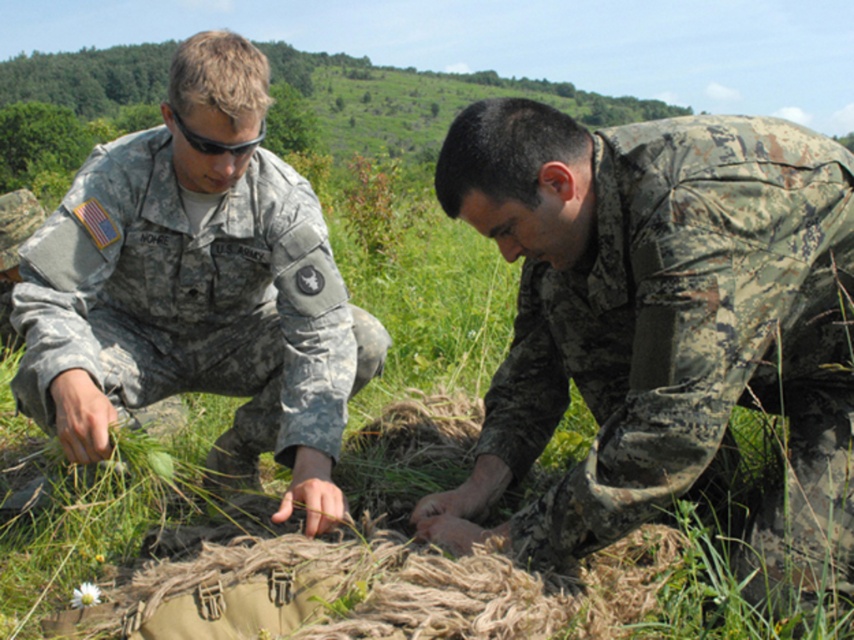
You are a drone operator trying to capture a closeup of the two military personnel in the image. You can only focus on one point at a time. Which point, point (687, 218) or point (28, 243), is closer to you and thus better for focusing on the person on the left?

Point (687, 218) is closer to the viewer than point (28, 243), so focusing on point (687, 218) would better capture the person on the left.

You are a photographer positioned at the back of the scene. You need to capture a photo that includes both the camouflage uniform at left and the black matte sunglasses at upper center. Which object should you adjust your camera angle to focus on first to ensure both are in frame?

The camouflage uniform at left is below the black matte sunglasses at upper center. To include both in the frame, you should first focus on the camouflage uniform at left, then adjust the angle upwards to include the black matte sunglasses at upper center.